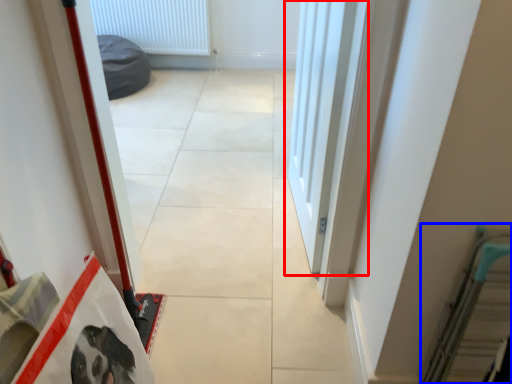
Question: Among these objects, which one is farthest to the camera, door (highlighted by a red box) or escalator (highlighted by a blue box)?

Choices:
 (A) door
 (B) escalator

Answer: (A)